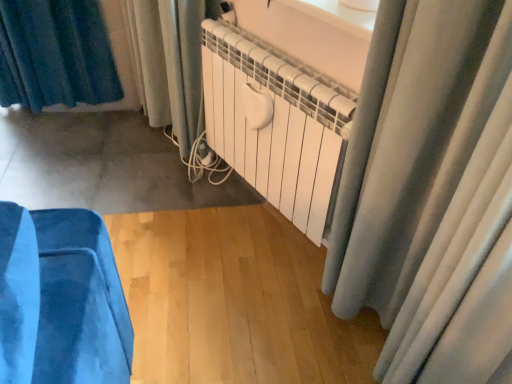
Identify the location of free area below white matte radiator at center (from a real-world perspective). (272, 233).